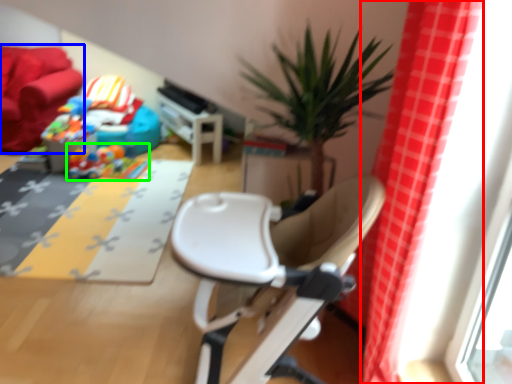
Question: Estimate the real-world distances between objects in this image. Which object is farther from curtain (highlighted by a red box), couch (highlighted by a blue box) or toy (highlighted by a green box)?

Choices:
 (A) couch
 (B) toy

Answer: (A)